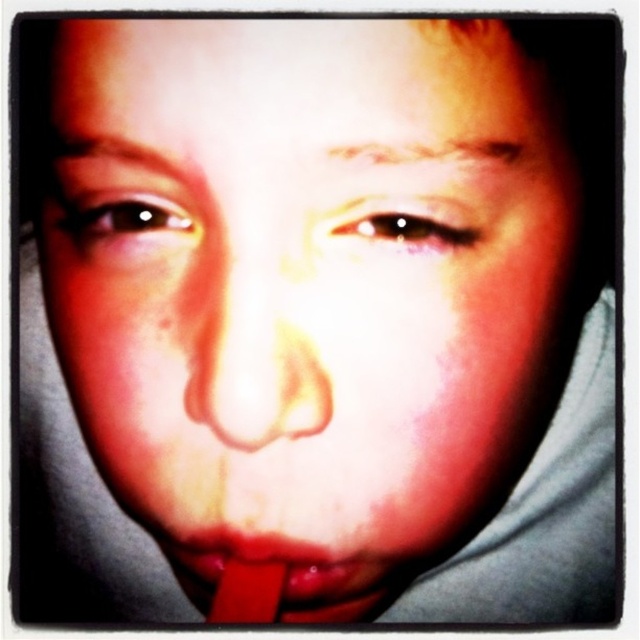
You are a photographer adjusting the lighting for a portrait. The subject has a point at coordinates point (250, 362) which is their nose. The current lighting creates a bright glare on the forehead and nose area. To reduce the glare on the nose, should you move the light source closer to or farther from the subject?

To reduce the glare on the nose at point (250, 362), move the light source farther from the subject. A farther light source spreads light more diffusely, reducing harsh glares.

Based on the coordinates provided in the image, where exactly is the smooth flesh nose at center positioned?

The smooth flesh nose at center is located at point coordinates of 0.566 on the x axis and 0.391 on the y axis.